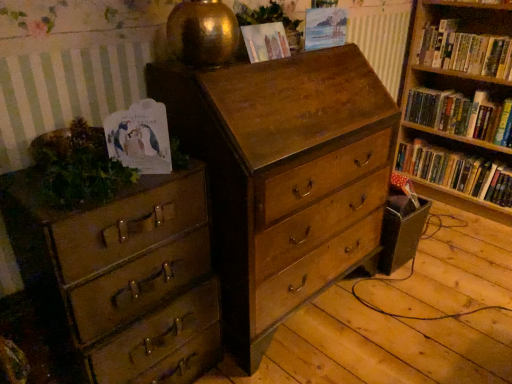
Question: From their relative heights in the image, would you say hardcover book at right, the third book from the top, is taller or shorter than matte brown chest of drawers at left, positioned as the 1th chest of drawers in left-to-right order?

Choices:
 (A) short
 (B) tall

Answer: (A)

Question: Is hardcover book at right, the third book from the top, bigger or smaller than matte brown chest of drawers at left, the second chest of drawers when ordered from right to left?

Choices:
 (A) small
 (B) big

Answer: (A)

Question: Estimate the real-world distances between objects in this image. Which object is farther from the white paper at left, positioned as the 3th paperback book in top-to-bottom order?

Choices:
 (A) matte brown chest of drawers at left, positioned as the 1th chest of drawers in left-to-right order
 (B) wooden chest of drawers at center, which is the 1th chest of drawers from right to left
 (C) hardcover book at right, which is the 3th book from bottom to top
 (D) green leafy plant at upper center, positioned as the 2th plant in left-to-right order
 (E) watercolor paper at upper center, which is counted as the second paperback book, starting from the front

Answer: (C)

Question: Which object is positioned closest to the wooden chest of drawers at center, the second chest of drawers viewed from the left?

Choices:
 (A) matte paper at upper center, arranged as the third paperback book when viewed from the left
 (B) green leafy plant at upper center, the 2th plant positioned from the bottom
 (C) green leafy plant at left, which is the 2th plant in top-to-bottom order
 (D) watercolor paper at upper center, acting as the second paperback book starting from the right
 (E) white paper at left, which is the 1th paperback book from front to back

Answer: (D)